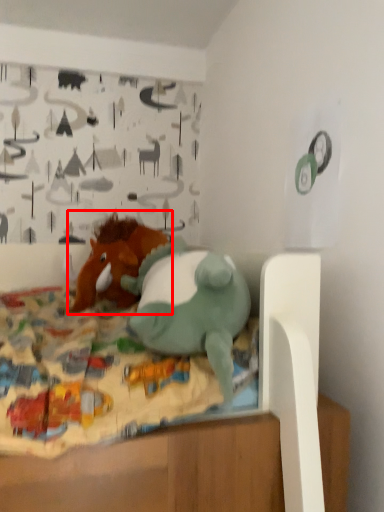
Question: From the image, what is the correct spatial relationship of toy (annotated by the red box) in relation to toy?

Choices:
 (A) right
 (B) left

Answer: (B)